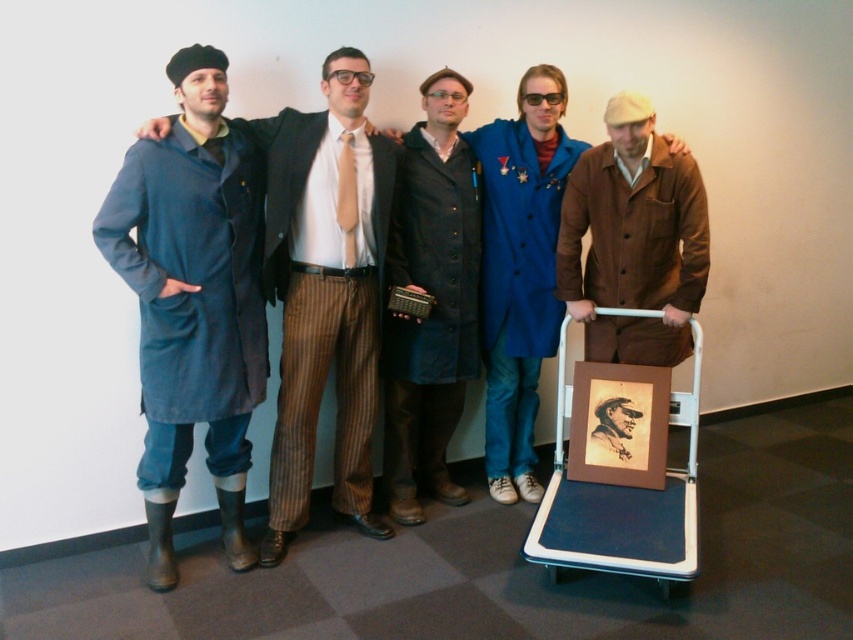
Is denim coat at left to the right of blue fabric cart at lower right from the viewer's perspective?

Incorrect, denim coat at left is not on the right side of blue fabric cart at lower right.

Does point (305, 150) come in front of point (646, 568)?

No, it is not.

The height and width of the screenshot is (640, 853). In order to click on denim coat at left in this screenshot , I will do `click(326, 292)`.

Does blue fabric cart at lower right have a greater height compared to brown suede jacket at right?

Correct, blue fabric cart at lower right is much taller as brown suede jacket at right.

Does blue fabric cart at lower right have a smaller size compared to brown suede jacket at right?

Actually, blue fabric cart at lower right might be larger than brown suede jacket at right.

Locate an element on the screen. This screenshot has width=853, height=640. blue fabric cart at lower right is located at coordinates (619, 474).

Which is more to the left, dark blue coat at center or blue fabric cart at lower right?

dark blue coat at center is more to the left.

Who is lower down, dark blue coat at center or blue fabric cart at lower right?

blue fabric cart at lower right is below.

Identify the location of dark blue coat at center. The width and height of the screenshot is (853, 640). (432, 298).

Locate an element on the screen. dark blue coat at center is located at coordinates (432, 298).